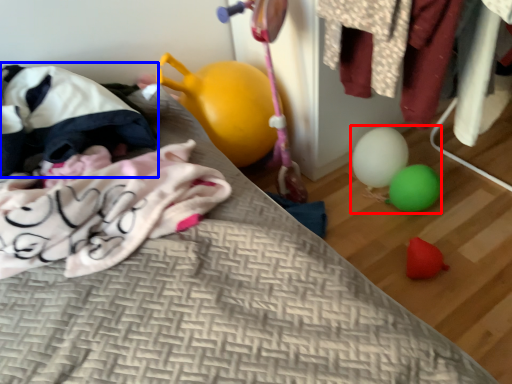
Question: Among these objects, which one is nearest to the camera, toy (highlighted by a red box) or bean bag chair (highlighted by a blue box)?

Choices:
 (A) toy
 (B) bean bag chair

Answer: (B)